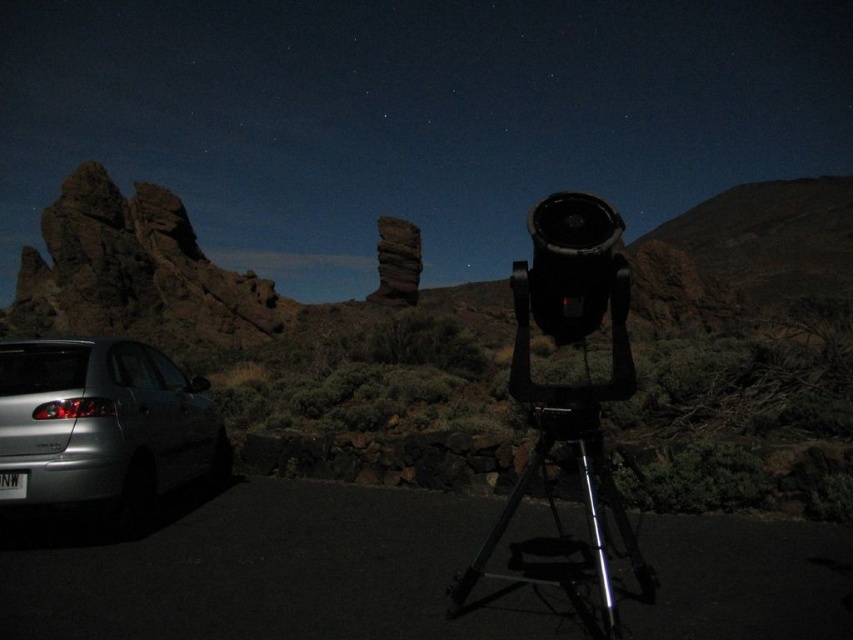
Does point (106, 344) come in front of point (151, 250)?

Yes, it is.

Who is shorter, silver metallic car at lower left or dark brown rocky outcrop at left?

Standing shorter between the two is silver metallic car at lower left.

Where is `silver metallic car at lower left`? The image size is (853, 640). silver metallic car at lower left is located at coordinates (102, 428).

Identify the location of silver metallic car at lower left. (102, 428).

Is silver metallic car at lower left behind silver metallic tripod at center?

That is True.

Is silver metallic car at lower left positioned before silver metallic tripod at center?

No, it is not.

The width and height of the screenshot is (853, 640). Find the location of `silver metallic car at lower left`. silver metallic car at lower left is located at coordinates (x=102, y=428).

Does dark brown rocky outcrop at left have a larger size compared to silver metallic tripod at center?

Correct, dark brown rocky outcrop at left is larger in size than silver metallic tripod at center.

Does point (151, 198) come farther from viewer compared to point (608, 506)?

Yes, it is behind point (608, 506).

Between point (22, 280) and point (573, 573), which one is positioned in front?

Point (573, 573) is more forward.

You are a GUI agent. You are given a task and a screenshot of the screen. Output one action in this format:
    pyautogui.click(x=<x>, y=<y>)
    Task: Click on the dark brown rocky outcrop at left
    The width and height of the screenshot is (853, 640).
    Given the screenshot: What is the action you would take?
    pyautogui.click(x=136, y=272)